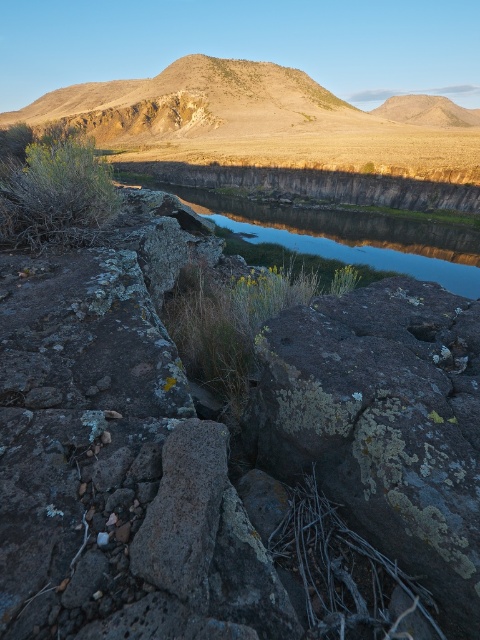
Question: Which of the following is the closest to the observer?

Choices:
 (A) rugged brown mountain at upper center
 (B) lichen-covered rock at center

Answer: (B)

Question: Can you confirm if lichen-covered rock at center is thinner than rugged brown mountain at upper center?

Choices:
 (A) yes
 (B) no

Answer: (A)

Question: Is lichen-covered rock at center further to camera compared to smooth reflective water at center?

Choices:
 (A) no
 (B) yes

Answer: (A)

Question: Which object appears farthest from the camera in this image?

Choices:
 (A) rugged brown mountain at upper center
 (B) lichen-covered rock at center

Answer: (A)

Question: Does lichen-covered rock at center appear over rugged brown mountain at upper center?

Choices:
 (A) no
 (B) yes

Answer: (A)

Question: Estimate the real-world distances between objects in this image. Which object is closer to the rugged brown mountain at upper center?

Choices:
 (A) smooth reflective water at center
 (B) lichen-covered rock at center

Answer: (B)